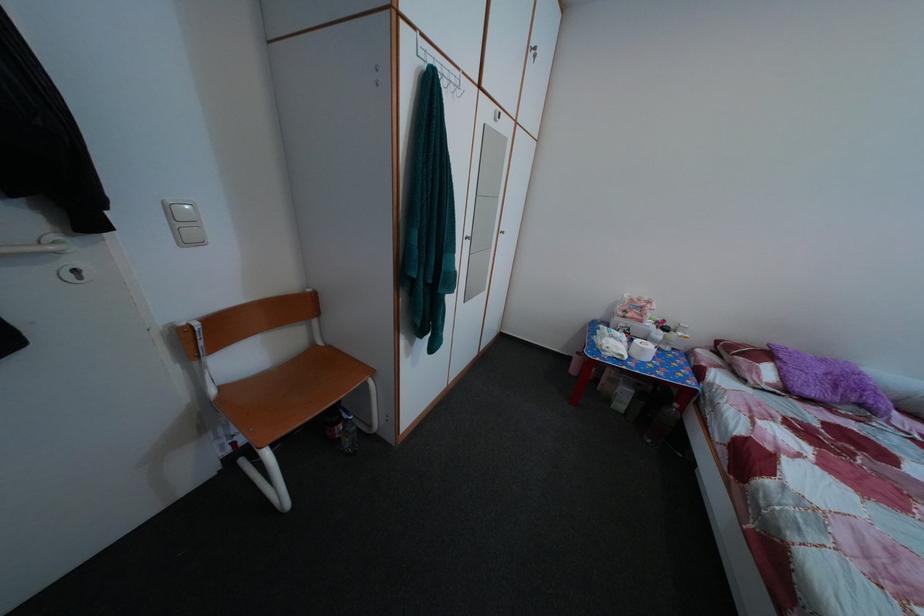
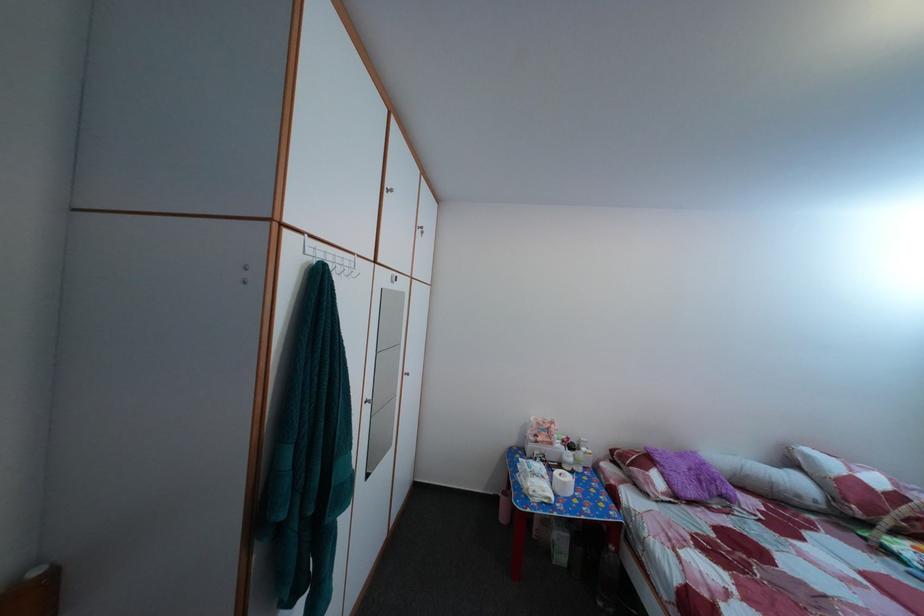
Locate, in the second image, the point that corresponds to the point at 832,369 in the first image.

(689, 464)